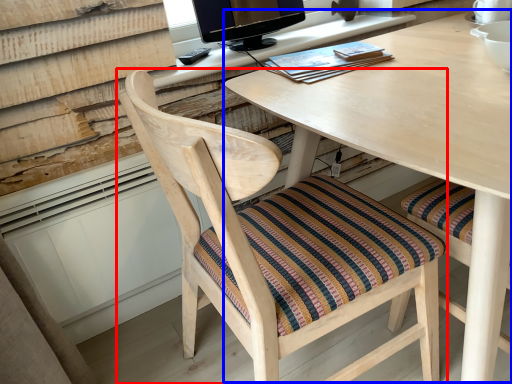
Question: Which object appears farthest to the camera in this image, chair (highlighted by a red box) or computer desk (highlighted by a blue box)?

Choices:
 (A) chair
 (B) computer desk

Answer: (B)